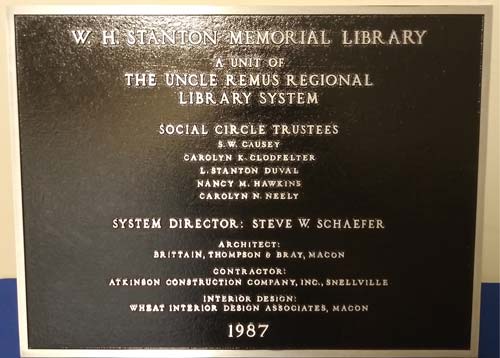
The width and height of the screenshot is (500, 358). In order to click on wall in this screenshot , I will do `click(491, 250)`.